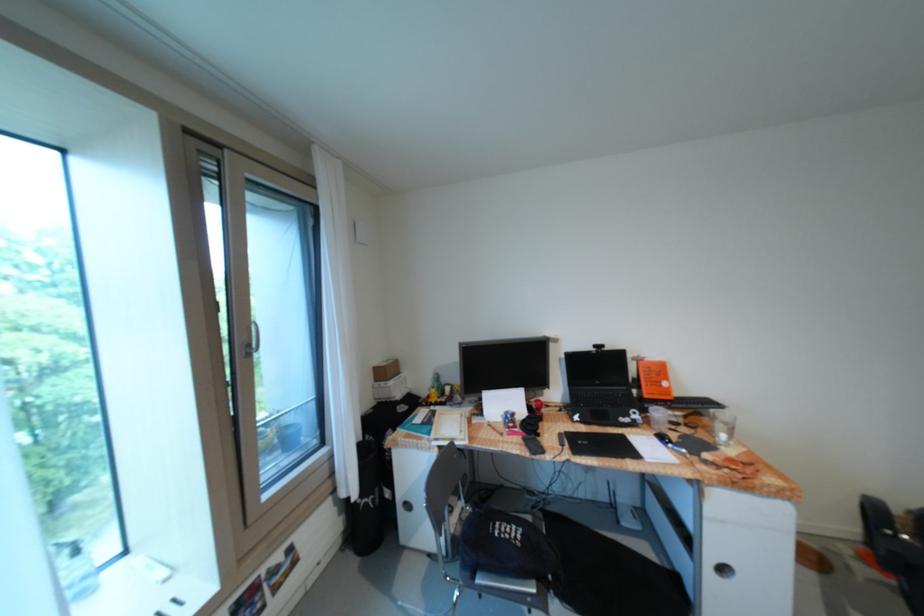
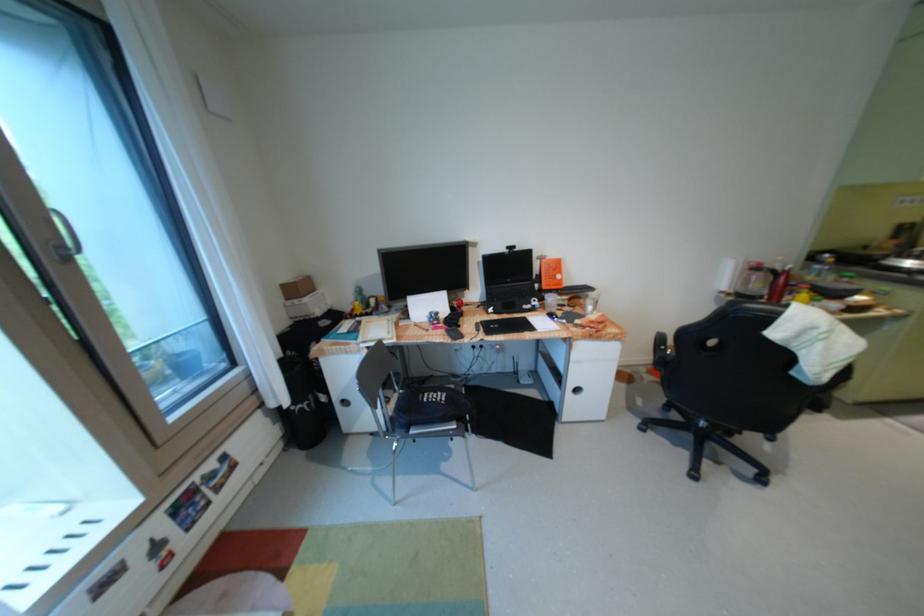
In the second image, find the point that corresponds to [387,384] in the first image.

(300, 302)